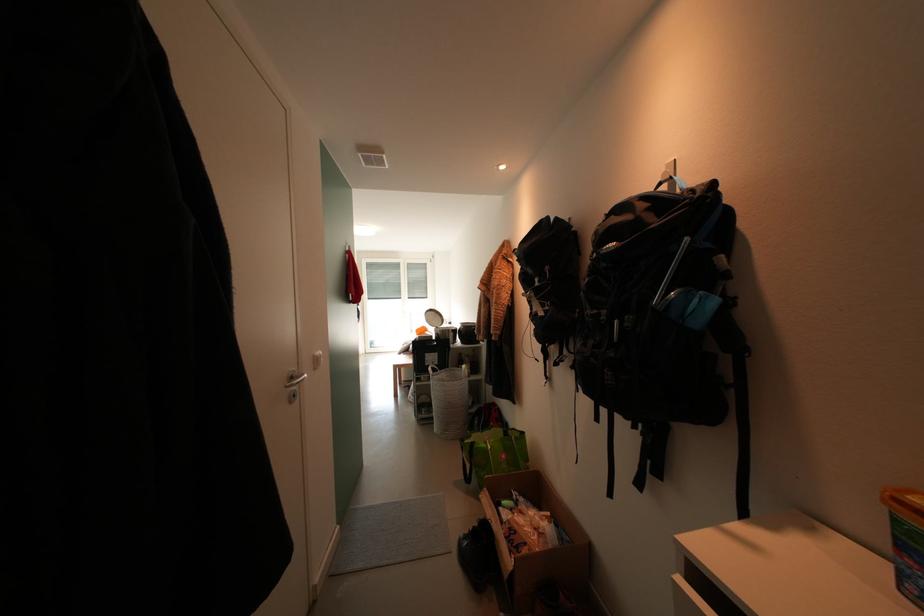
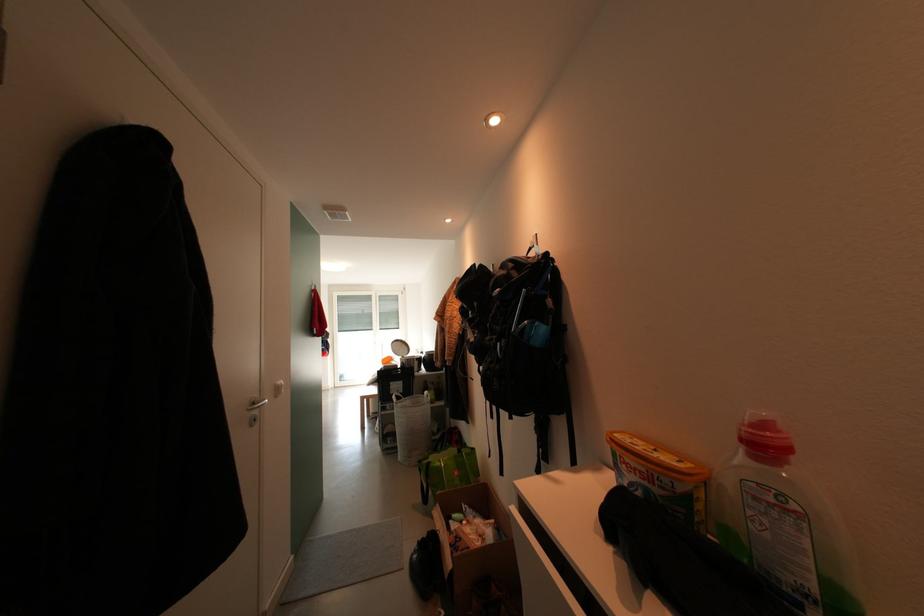
Locate, in the second image, the point that corresponds to (x=667, y=188) in the first image.

(538, 253)